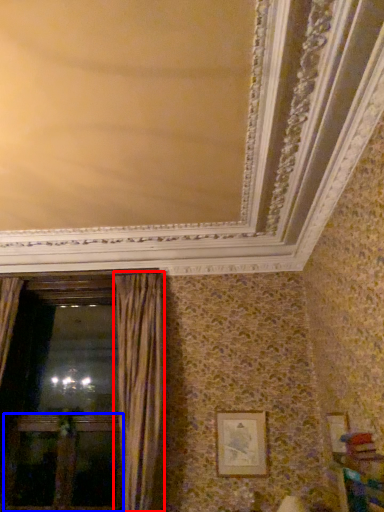
Question: Among these objects, which one is farthest to the camera, curtain (highlighted by a red box) or screen door (highlighted by a blue box)?

Choices:
 (A) curtain
 (B) screen door

Answer: (B)